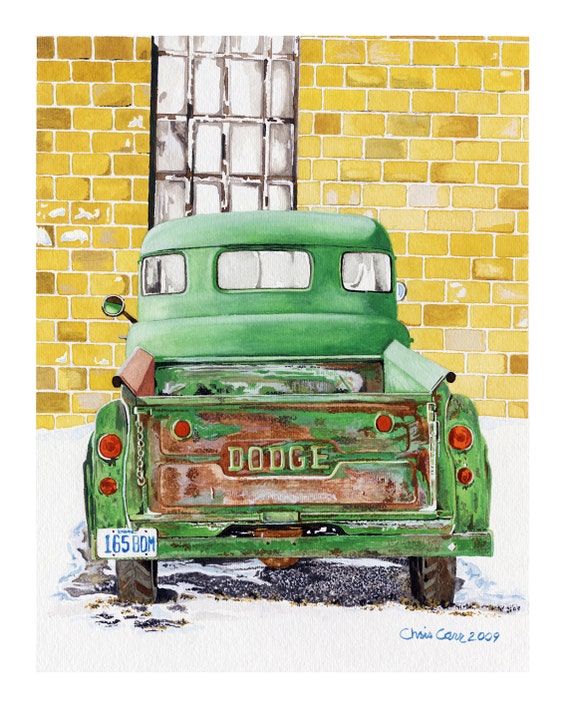
Image resolution: width=570 pixels, height=710 pixels. What are the coordinates of `left mirror` in the screenshot? It's located at (113, 305).